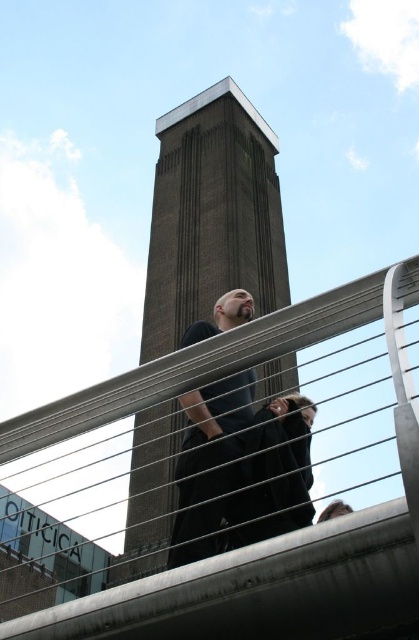
Can you confirm if brown brick tower at center is thinner than dark blue shirt at center?

In fact, brown brick tower at center might be wider than dark blue shirt at center.

Between brown brick tower at center and dark blue shirt at center, which one appears on the right side from the viewer's perspective?

Positioned to the right is dark blue shirt at center.

This screenshot has height=640, width=419. I want to click on brown brick tower at center, so click(x=212, y=216).

Is metallic gray pedestrian bridge at center further to camera compared to dark blue shirt at center?

No, it is in front of dark blue shirt at center.

This screenshot has height=640, width=419. What do you see at coordinates (232, 490) in the screenshot?
I see `metallic gray pedestrian bridge at center` at bounding box center [232, 490].

Locate an element on the screen. This screenshot has height=640, width=419. metallic gray pedestrian bridge at center is located at coordinates (232, 490).

Is point (33, 451) positioned after point (180, 288)?

No, (33, 451) is closer to viewer.

Can you confirm if metallic gray pedestrian bridge at center is shorter than brown brick tower at center?

Yes, metallic gray pedestrian bridge at center is shorter than brown brick tower at center.

This screenshot has height=640, width=419. Describe the element at coordinates (232, 490) in the screenshot. I see `metallic gray pedestrian bridge at center` at that location.

At what (x,y) coordinates should I click in order to perform the action: click on metallic gray pedestrian bridge at center. Please return your answer as a coordinate pair (x, y). Looking at the image, I should click on (232, 490).